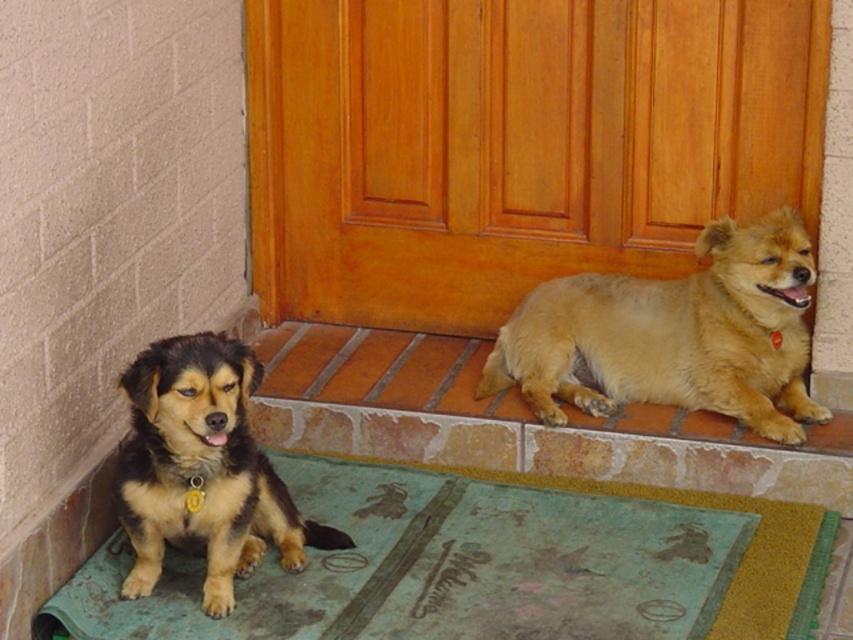
You are a delivery person trying to place a small package between the green fabric doormat at lower left and the light brown fur at lower right. The package is 24 inches long. Will it fit in the space between them?

The distance between the green fabric doormat at lower left and the light brown fur at lower right is 24.38 inches. Since the package is 24 inches long, it will fit with a small amount of space to spare.

You are a dog trainer observing two dogs on a porch. You need to determine which dog has a larger size based on their positions. The dogs are the light brown fur at lower right and the brown fur dog at left. Can you identify which one is bigger?

The light brown fur at lower right is bigger than the brown fur dog at left.